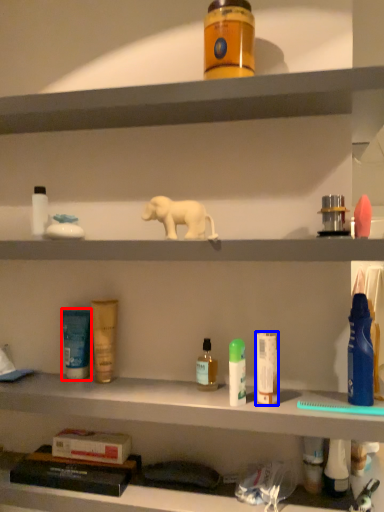
Question: Which object is closer to the camera taking this photo, toiletry (highlighted by a red box) or toiletry (highlighted by a blue box)?

Choices:
 (A) toiletry
 (B) toiletry

Answer: (B)